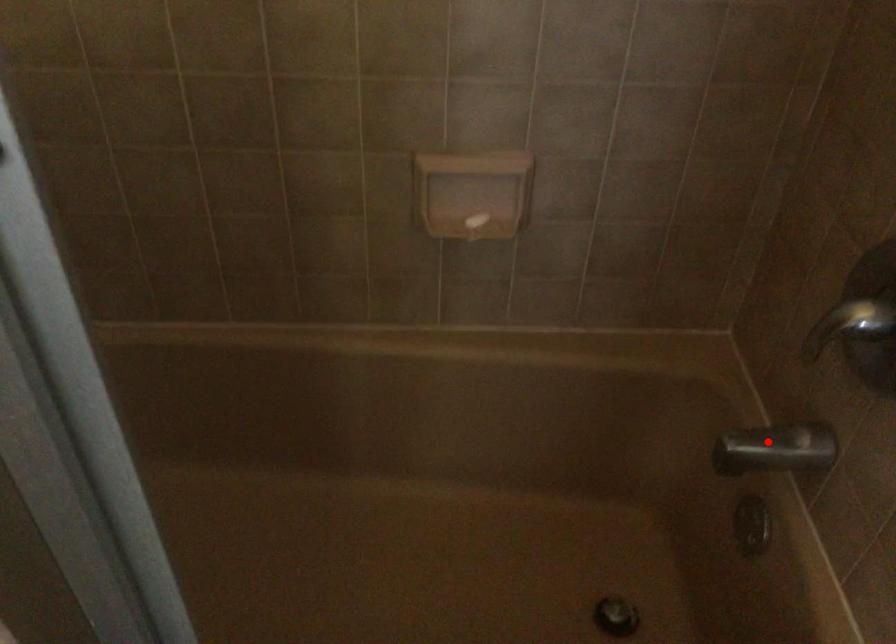
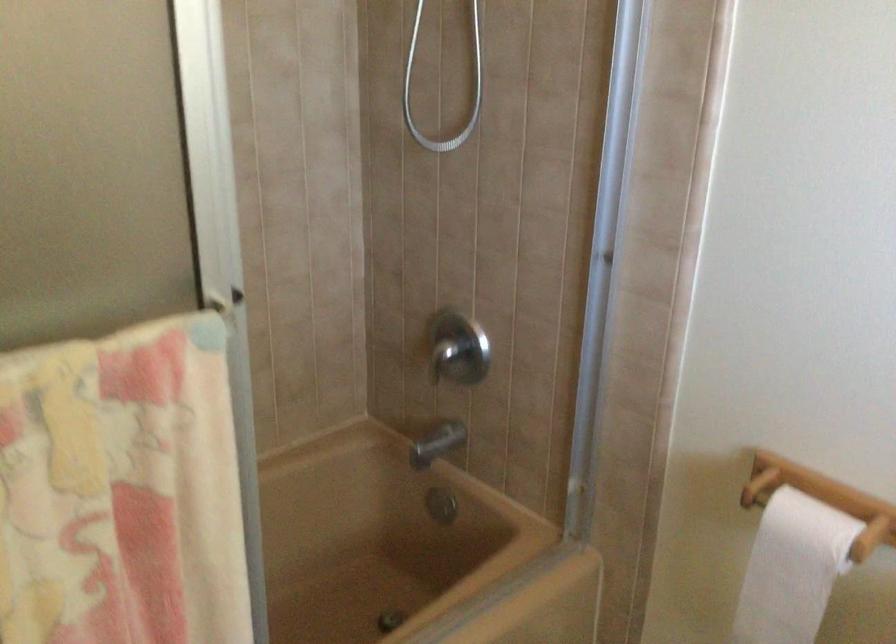
Question: I am providing you with two images of the same scene from different viewpoints. Image1 has a red point marked. In image2, the corresponding 3D location appears at what relative position? Reply with the corresponding letter.

Choices:
 (A) Closer
 (B) Farther

Answer: (B)